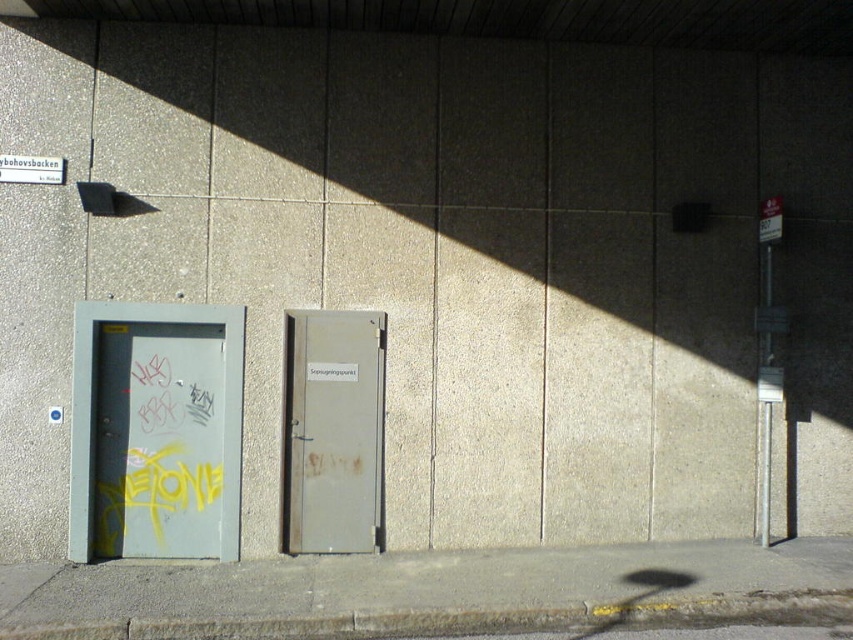
You are a delivery person trying to enter the building through the doors. You need to know which door is higher up. Which door is positioned higher on the wall, the metallic gray door at left or the rusty metal door at center?

The metallic gray door at left is positioned over the rusty metal door at center, so the metallic gray door at left is higher up on the wall.

You are a delivery person with a cart that is 1 meter wide. You need to pass through the space between the metallic gray door at left and the rusty metal door at center. Can your cart fit through the gap?

The metallic gray door at left and rusty metal door at center are 91.79 centimeters apart. Since the cart is 1 meter wide, which is 100 centimeters, the gap is slightly narrower than the cart. Therefore, the cart cannot fit through the space between the metallic gray door at left and the rusty metal door at center.

You are standing in front of the wall with two doors. You need to locate the metallic gray door at left. What are its 2D coordinates?

The metallic gray door at left is located at the 2D coordinates of point (155, 429).